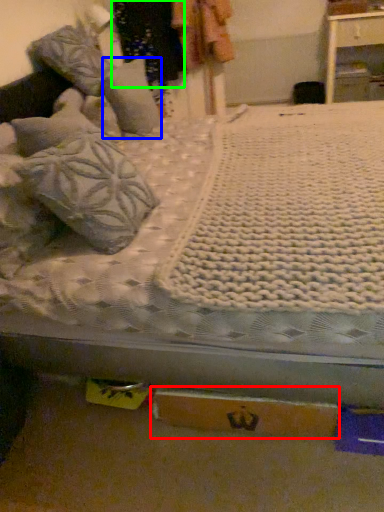
Question: Based on their relative distances, which object is nearer to cardboard box (highlighted by a red box)? Choose from pillow (highlighted by a blue box) and clothing (highlighted by a green box).

Choices:
 (A) pillow
 (B) clothing

Answer: (A)